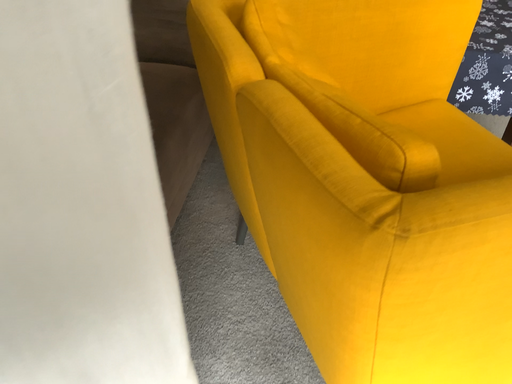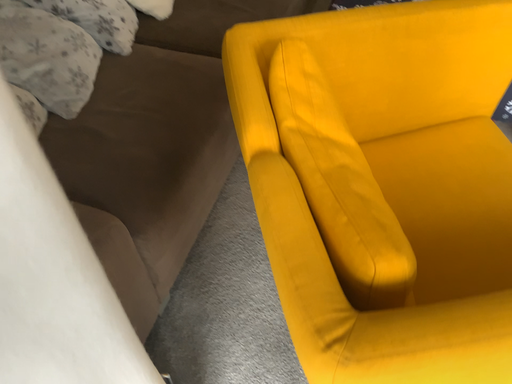
Question: Which way did the camera rotate in the video?

Choices:
 (A) rotated upward
 (B) rotated downward

Answer: (B)